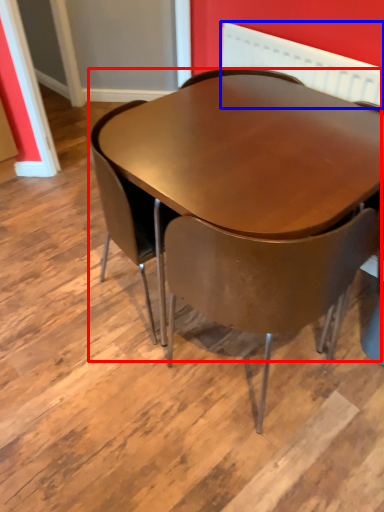
Question: Which object appears farthest to the camera in this image, table (highlighted by a red box) or radiator (highlighted by a blue box)?

Choices:
 (A) table
 (B) radiator

Answer: (B)